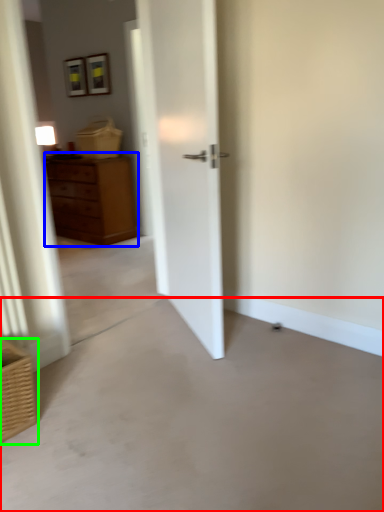
Question: Which is nearer to the concrete (highlighted by a red box)? chest of drawers (highlighted by a blue box) or basket (highlighted by a green box).

Choices:
 (A) chest of drawers
 (B) basket

Answer: (B)